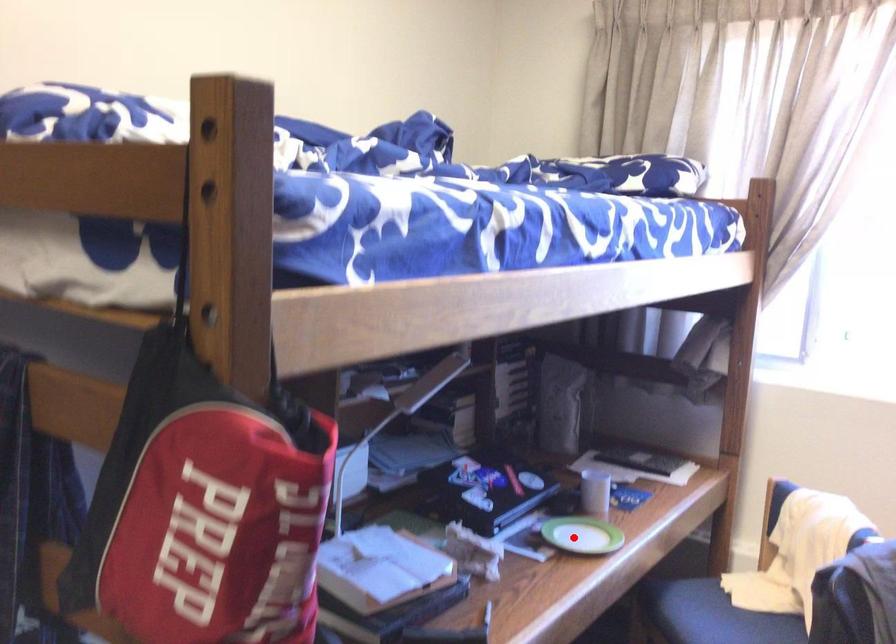
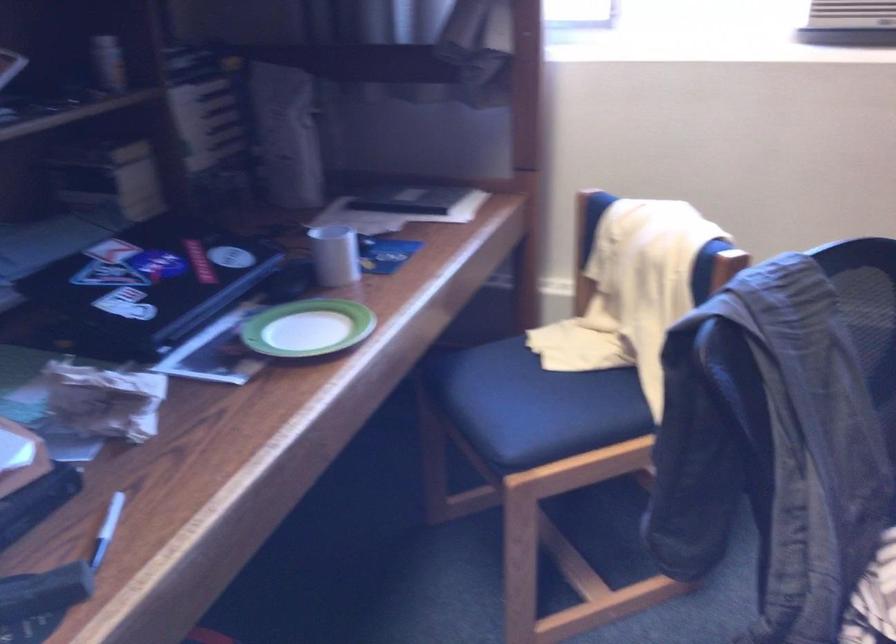
Question: I am providing you with two images of the same scene from different viewpoints. Image1 has a red point marked. In image2, the corresponding 3D location appears at what relative position? Reply with the corresponding letter.

Choices:
 (A) Closer
 (B) Farther

Answer: (A)